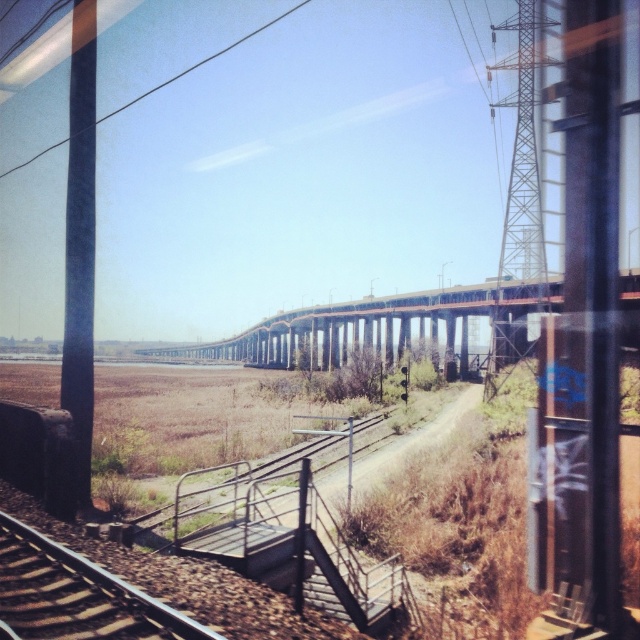
Is the position of rusty steel bridge at center less distant than that of brown gravel train track at lower left?

Yes, rusty steel bridge at center is closer to the viewer.

Image resolution: width=640 pixels, height=640 pixels. In order to click on rusty steel bridge at center in this screenshot , I will do `click(387, 326)`.

Is point (451, 330) in front of point (134, 616)?

No.

I want to click on rusty steel bridge at center, so click(387, 326).

This screenshot has width=640, height=640. What are the coordinates of `brown gravel train track at lower left` in the screenshot? It's located at (76, 595).

Does point (179, 611) lie in front of point (214, 52)?

Yes, it is.

Is point (96, 568) more distant than point (204, 58)?

That is False.

Find the location of a particular element. This screenshot has height=640, width=640. brown gravel train track at lower left is located at coordinates (76, 595).

Between rusty steel bridge at center and black wire at upper center, which one appears on the left side from the viewer's perspective?

black wire at upper center

Is rusty steel bridge at center above black wire at upper center?

Incorrect, rusty steel bridge at center is not positioned above black wire at upper center.

Where is `rusty steel bridge at center`? The image size is (640, 640). rusty steel bridge at center is located at coordinates (387, 326).

The width and height of the screenshot is (640, 640). In order to click on rusty steel bridge at center in this screenshot , I will do `click(387, 326)`.